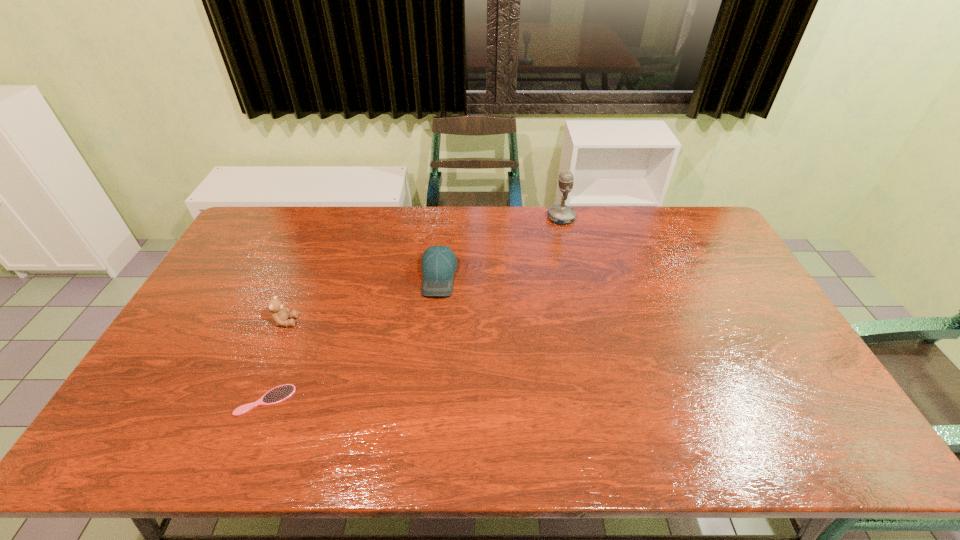
At what (x,y) coordinates should I click in order to perform the action: click on vacant area that satisfies the following two spatial constraints: 1. on the back side of the shortest object; 2. on the face of the teddy bear. Please return your answer as a coordinate pair (x, y). This screenshot has height=540, width=960. Looking at the image, I should click on (298, 322).